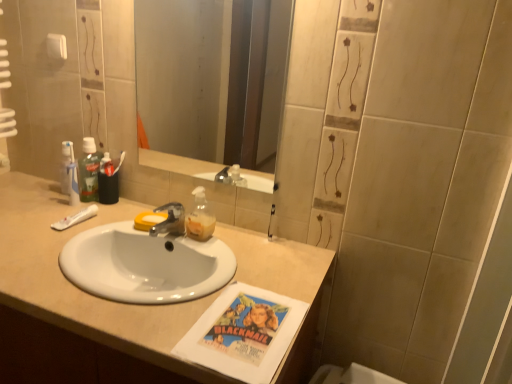
Locate an element on the screen. empty space that is to the right of translucent plastic soap dispenser at center is located at coordinates point(234,245).